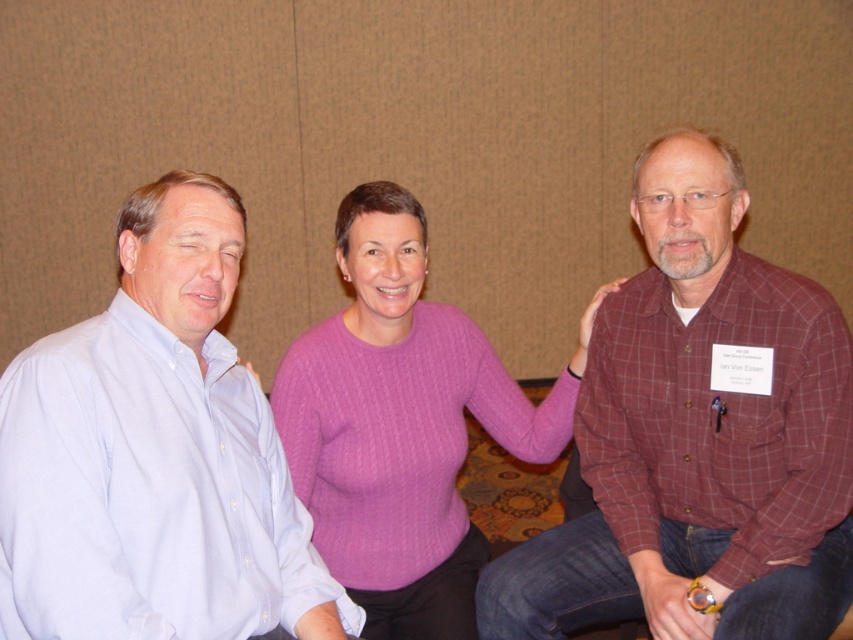
Question: Which object is positioned closest to the light blue shirt at left?

Choices:
 (A) plaid shirt at center
 (B) purple cable-knit sweater at center

Answer: (B)

Question: Where is plaid shirt at center located in relation to light blue shirt at left in the image?

Choices:
 (A) right
 (B) left

Answer: (A)

Question: Estimate the real-world distances between objects in this image. Which object is closer to the plaid shirt at center?

Choices:
 (A) purple cable-knit sweater at center
 (B) light blue shirt at left

Answer: (A)

Question: Considering the relative positions of plaid shirt at center and purple cable-knit sweater at center in the image provided, where is plaid shirt at center located with respect to purple cable-knit sweater at center?

Choices:
 (A) left
 (B) right

Answer: (B)

Question: Which point appears farthest from the camera in this image?

Choices:
 (A) (747, 300)
 (B) (167, 209)

Answer: (A)

Question: Does plaid shirt at center have a lesser width compared to light blue shirt at left?

Choices:
 (A) no
 (B) yes

Answer: (A)